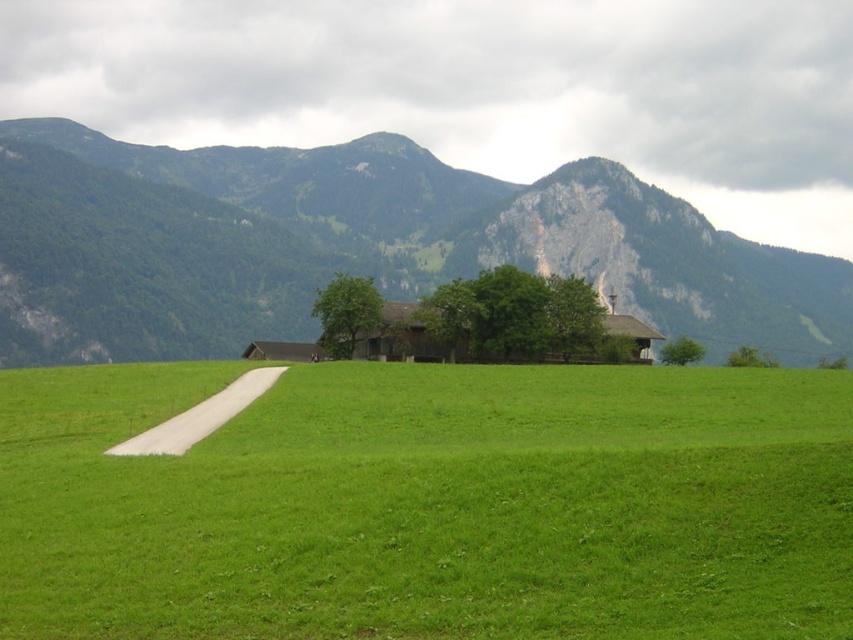
You are a farmer planning to plant crops in the green grassy pasture at center and the green grassy field at lower center. Which area has a wider space for planting?

The green grassy field at lower center has a greater width than the green grassy pasture at center, so it offers a wider space for planting crops.

From the picture: You are a hiker who wants to walk from the green grassy field at lower center to the green grassy pasture at center. Given that your average walking speed is 5 km per hour, how many minutes will it take you to reach the pasture?

The distance between the green grassy pasture at center and the green grassy field at lower center is 299.54 meters. Converting this to kilometers gives 0.29954 km. Dividing this by your walking speed of 5 km per hour yields approximately 0.0599 hours. Multiplying by 60 minutes gives roughly 3.59 minutes. Therefore, it will take approximately 3.6 minutes to reach the pasture.